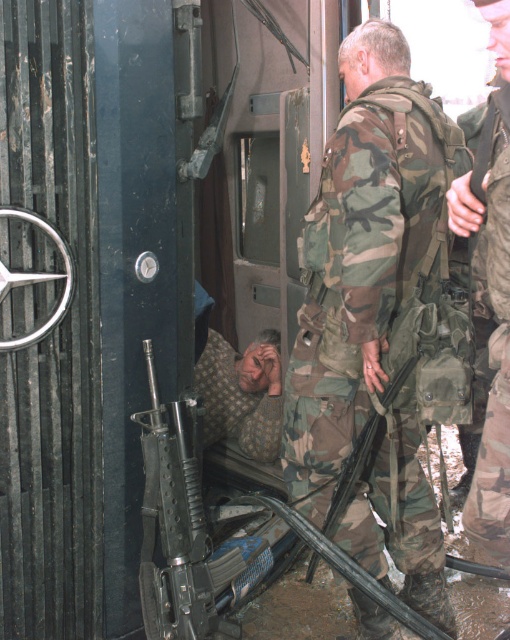
Question: Which point is farther to the camera?

Choices:
 (A) camouflage fabric uniform at center
 (B) camouflage uniform at center

Answer: (A)

Question: From the image, what is the correct spatial relationship of camouflage fabric uniform at center in relation to camouflage uniform at center?

Choices:
 (A) below
 (B) above

Answer: (A)

Question: Is camouflage fabric uniform at center below camouflage uniform at center?

Choices:
 (A) no
 (B) yes

Answer: (B)

Question: Which of the following is the closest to the observer?

Choices:
 (A) (496, 180)
 (B) (380, 336)

Answer: (A)

Question: Which point is farther to the camera?

Choices:
 (A) (489, 262)
 (B) (340, 259)

Answer: (B)

Question: Where is camouflage fabric uniform at center located in relation to camouflage uniform at center in the image?

Choices:
 (A) left
 (B) right

Answer: (A)